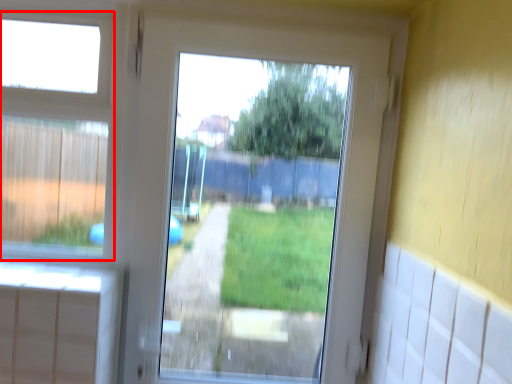
Question: In this image, where is bay window (annotated by the red box) located relative to screen door?

Choices:
 (A) left
 (B) right

Answer: (A)